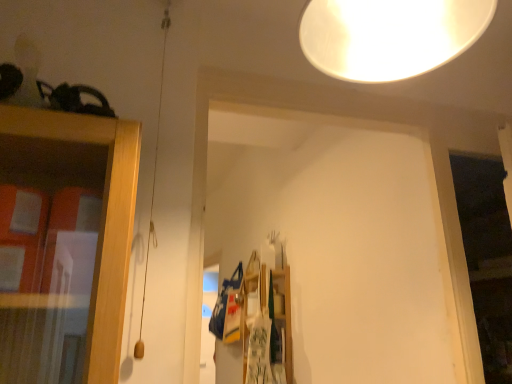
The width and height of the screenshot is (512, 384). In order to click on white glossy lampshade at upper center in this screenshot , I will do `click(389, 36)`.

The width and height of the screenshot is (512, 384). What do you see at coordinates (389, 36) in the screenshot?
I see `white glossy lampshade at upper center` at bounding box center [389, 36].

Measure the distance between white glossy lampshade at upper center and camera.

A distance of 25.12 inches exists between white glossy lampshade at upper center and camera.

This screenshot has width=512, height=384. What do you see at coordinates (268, 314) in the screenshot?
I see `wooden at center` at bounding box center [268, 314].

What is the approximate width of wooden at center?

The width of wooden at center is 11.62 inches.

This screenshot has height=384, width=512. I want to click on wooden at center, so click(x=268, y=314).

Find the location of a particular element. white glossy lampshade at upper center is located at coordinates (389, 36).

Considering the relative positions of wooden at center and white glossy lampshade at upper center in the image provided, is wooden at center to the left of white glossy lampshade at upper center from the viewer's perspective?

Yes, wooden at center is to the left of white glossy lampshade at upper center.

Between wooden at center and white glossy lampshade at upper center, which one is positioned behind?

Positioned behind is wooden at center.

Which point is more distant from viewer, (245, 372) or (317, 38)?

The point (245, 372) is farther from the camera.

From the image's perspective, does wooden at center appear lower than white glossy lampshade at upper center?

Yes, from the image's perspective, wooden at center is below white glossy lampshade at upper center.

From a real-world perspective, is wooden at center physically above white glossy lampshade at upper center?

No, from a real-world perspective, wooden at center is not above white glossy lampshade at upper center.

Which of these two, wooden at center or white glossy lampshade at upper center, is thinner?

Thinner between the two is white glossy lampshade at upper center.

Which of these two, wooden at center or white glossy lampshade at upper center, stands shorter?

white glossy lampshade at upper center is shorter.

Considering the sizes of objects wooden at center and white glossy lampshade at upper center in the image provided, who is bigger, wooden at center or white glossy lampshade at upper center?

wooden at center.

Which is correct: wooden at center is inside white glossy lampshade at upper center, or outside of it?

wooden at center cannot be found inside white glossy lampshade at upper center.

Are wooden at center and white glossy lampshade at upper center far apart?

Yes, wooden at center is far from white glossy lampshade at upper center.

Is wooden at center turned away from white glossy lampshade at upper center?

That's not correct — wooden at center is not looking away from white glossy lampshade at upper center.

How different are the orientations of wooden at center and white glossy lampshade at upper center in degrees?

There is a 86.2-degree angle between the facing directions of wooden at center and white glossy lampshade at upper center.

Where is `shelf below the white glossy lampshade at upper center (from a real-world perspective)`? The height and width of the screenshot is (384, 512). shelf below the white glossy lampshade at upper center (from a real-world perspective) is located at coordinates (268, 314).

Which is more to the right, white glossy lampshade at upper center or wooden at center?

Positioned to the right is white glossy lampshade at upper center.

Considering the relative positions of white glossy lampshade at upper center and wooden at center in the image provided, is white glossy lampshade at upper center in front of wooden at center?

Yes, white glossy lampshade at upper center is closer to the camera.

Which is in front, point (350, 9) or point (238, 298)?

Positioned in front is point (350, 9).

From the image's perspective, which object appears higher, white glossy lampshade at upper center or wooden at center?

white glossy lampshade at upper center, from the image's perspective.

From a real-world perspective, which is physically above, white glossy lampshade at upper center or wooden at center?

white glossy lampshade at upper center, from a real-world perspective.

Does white glossy lampshade at upper center have a lesser width compared to wooden at center?

Yes, white glossy lampshade at upper center is thinner than wooden at center.

Does white glossy lampshade at upper center have a greater height compared to wooden at center?

In fact, white glossy lampshade at upper center may be shorter than wooden at center.

From the picture: Based on their sizes in the image, would you say white glossy lampshade at upper center is bigger or smaller than wooden at center?

white glossy lampshade at upper center is smaller than wooden at center.

Would you say white glossy lampshade at upper center is inside or outside wooden at center?

white glossy lampshade at upper center cannot be found inside wooden at center.

Is white glossy lampshade at upper center next to wooden at center and touching it?

white glossy lampshade at upper center and wooden at center are clearly separated.

Could you tell me if white glossy lampshade at upper center is turned towards wooden at center?

No, white glossy lampshade at upper center is not oriented towards wooden at center.

You are a GUI agent. You are given a task and a screenshot of the screen. Output one action in this format:
    pyautogui.click(x=<x>, y=<y>)
    Task: Click on the lamp to the right of wooden at center
    Image resolution: width=512 pixels, height=384 pixels.
    Given the screenshot: What is the action you would take?
    pyautogui.click(x=389, y=36)

At what (x,y) coordinates should I click in order to perform the action: click on lamp located on the right of wooden at center. Please return your answer as a coordinate pair (x, y). This screenshot has width=512, height=384. Looking at the image, I should click on (389, 36).

In the image, there is a white glossy lampshade at upper center. Where is `shelf below it (from the image's perspective)`? shelf below it (from the image's perspective) is located at coordinates (268, 314).